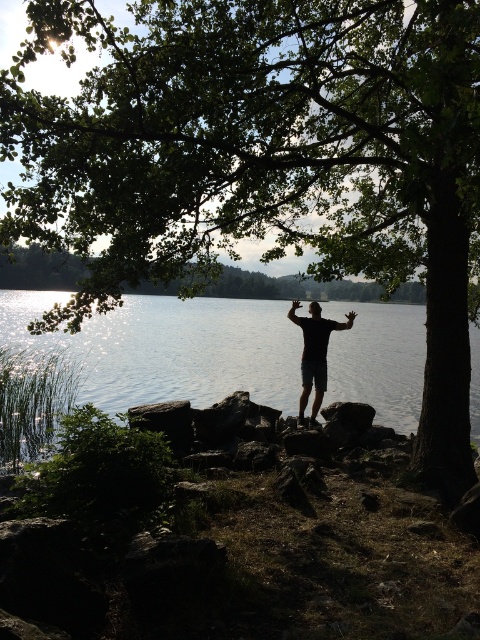
Is black matte shorts at center positioned at the back of black matte arm at center?

No, black matte shorts at center is in front of black matte arm at center.

Is point (319, 339) closer to camera compared to point (299, 305)?

Yes.

Identify the location of black matte shorts at center. (314, 355).

I want to click on clear water at center, so click(x=169, y=348).

Who is taller, clear water at center or black matte shorts at center?

With more height is clear water at center.

Where is `clear water at center`? clear water at center is located at coordinates (169, 348).

This screenshot has width=480, height=640. In order to click on clear water at center in this screenshot , I will do pyautogui.click(x=169, y=348).

Is clear water at center bigger than black matte arm at upper center?

Yes, clear water at center is bigger than black matte arm at upper center.

Does point (291, 332) come behind point (336, 326)?

Yes, it is behind point (336, 326).

This screenshot has width=480, height=640. In order to click on clear water at center in this screenshot , I will do `click(169, 348)`.